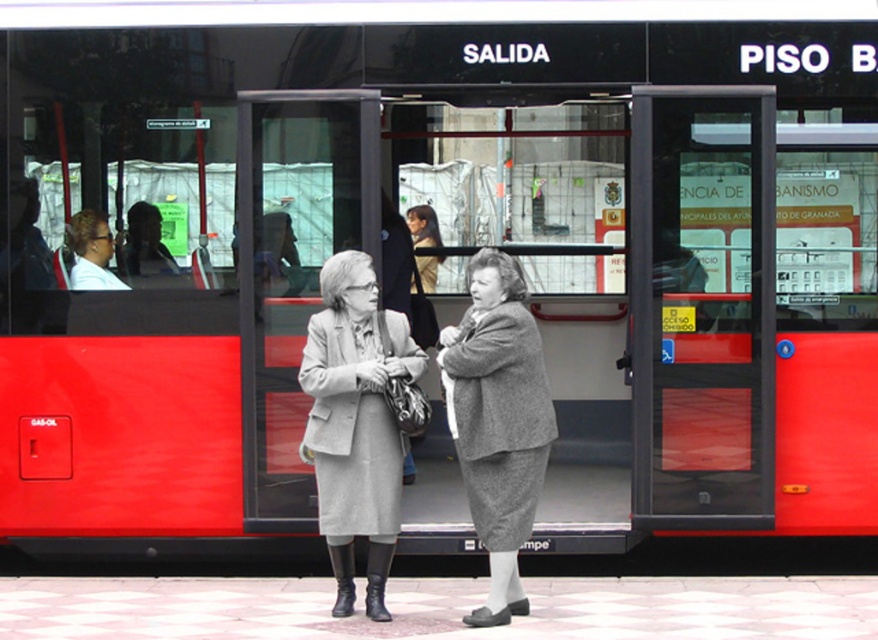
Is gray wool coat at center below gray woolen suit at center?

Indeed, gray wool coat at center is positioned under gray woolen suit at center.

Does gray wool coat at center lie behind gray woolen suit at center?

That is True.

Is point (348, 376) farther from viewer compared to point (457, 380)?

No.

Identify the location of gray wool coat at center. This screenshot has width=878, height=640. (356, 422).